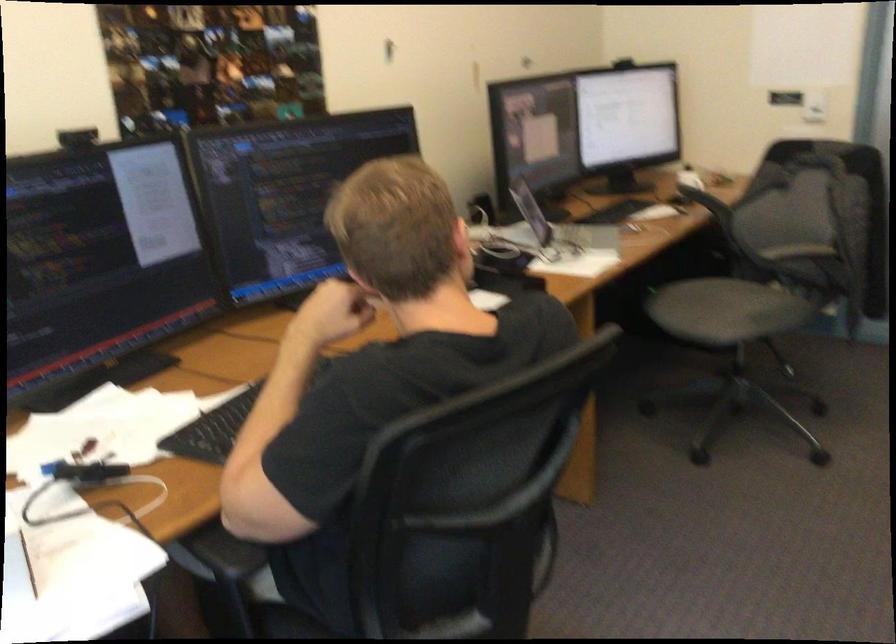
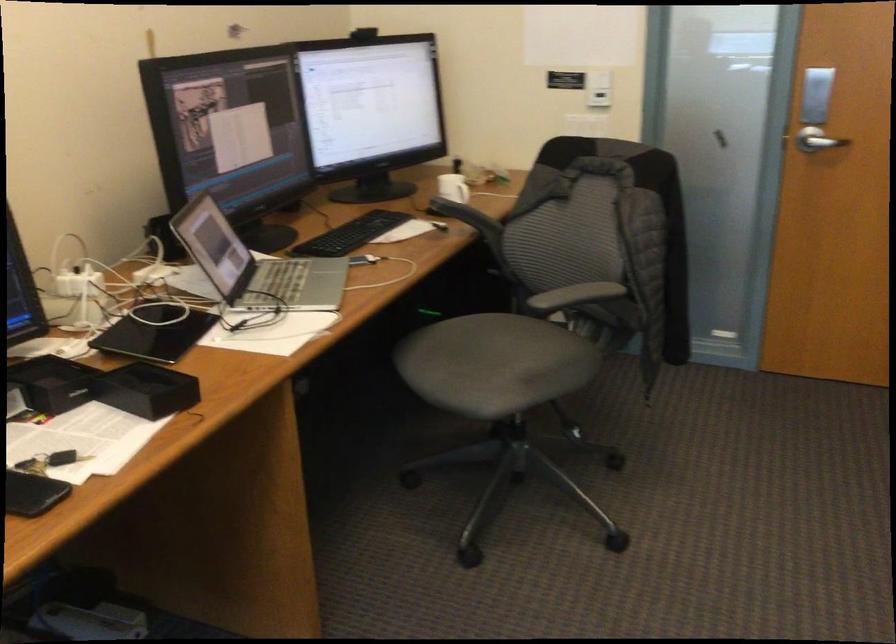
Which direction would the cameraman need to move to produce the second image?

The movement direction of the cameraman is right, forward.